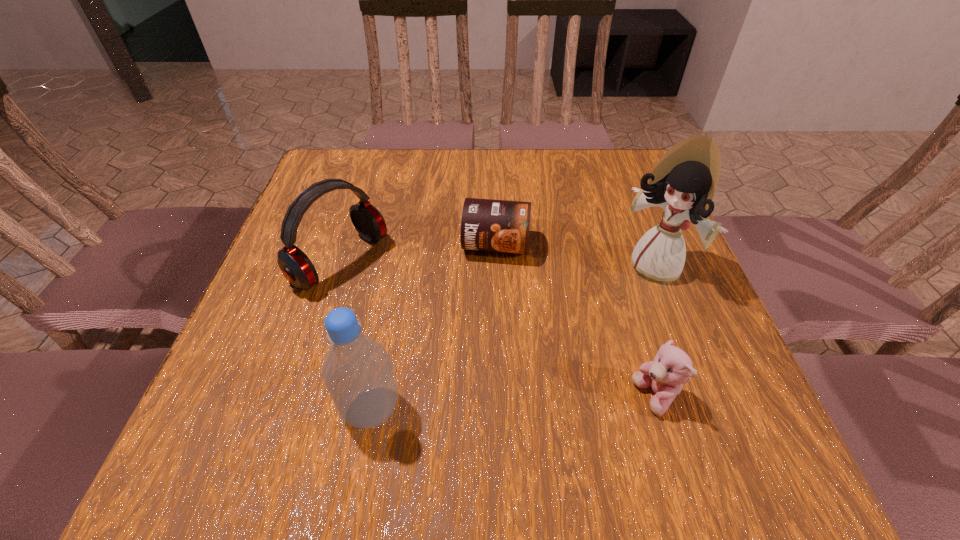
You are a GUI agent. You are given a task and a screenshot of the screen. Output one action in this format:
    pyautogui.click(x=<x>, y=<y>)
    Task: Click on the blank region between the teddy bear and the doll
    The image size is (960, 540).
    Given the screenshot: What is the action you would take?
    click(x=655, y=333)

I want to click on free area in between the bottle and the teddy bear, so click(514, 403).

Where is `free point between the teddy bear and the second tallest object`? This screenshot has height=540, width=960. free point between the teddy bear and the second tallest object is located at coordinates (514, 403).

Image resolution: width=960 pixels, height=540 pixels. Identify the location of free space between the can and the tallest object. (575, 256).

This screenshot has height=540, width=960. I want to click on vacant point located between the third object from right to left and the bottle, so click(x=434, y=327).

The height and width of the screenshot is (540, 960). In order to click on free spot between the teddy bear and the third object from left to right in this screenshot , I will do `click(575, 321)`.

The height and width of the screenshot is (540, 960). I want to click on vacant region between the third shortest object and the teddy bear, so click(497, 329).

Where is `vacant point located between the teddy bear and the third tallest object`? vacant point located between the teddy bear and the third tallest object is located at coordinates (497, 329).

Choose which object is the nearest neighbor to the teddy bear. Please provide its 2D coordinates. Your answer should be formatted as a tuple, i.e. [(x, y)], where the tuple contains the x and y coordinates of a point satisfying the conditions above.

[(683, 182)]

Find the location of `object identified as the second closest to the earphone`. object identified as the second closest to the earphone is located at coordinates (357, 371).